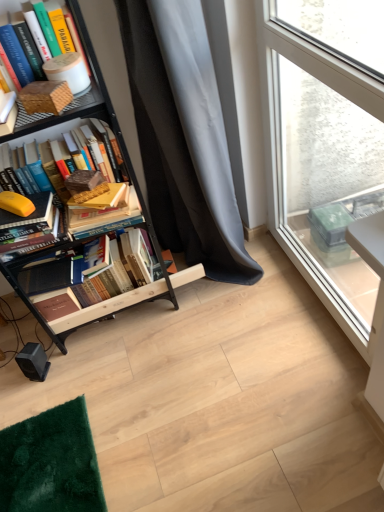
Question: Based on their positions, is orange matte banana at lower left, placed as the third book when sorted from top to bottom, located to the left or right of matte brown book at upper left, which ranks as the fifth book in bottom-to-top order?

Choices:
 (A) right
 (B) left

Answer: (B)

Question: Is orange matte banana at lower left, placed as the third book when sorted from top to bottom, taller or shorter than matte brown book at upper left, which ranks as the fifth book in bottom-to-top order?

Choices:
 (A) short
 (B) tall

Answer: (A)

Question: Estimate the real-world distances between objects in this image. Which object is closer to the gray fabric curtain at center?

Choices:
 (A) orange matte banana at lower left, acting as the 3th book starting from the bottom
 (B) matte orange book at left, which appears as the 2th book when ordered from the bottom
 (C) matte brown book at upper left, which ranks as the fifth book in bottom-to-top order
 (D) hardcover books at left, the first book ordered from the bottom
 (E) hardcover book at left, marked as the 4th book in a bottom-to-top arrangement

Answer: (E)

Question: Which is nearer to the orange matte banana at lower left, placed as the third book when sorted from top to bottom?

Choices:
 (A) transparent glass window at upper right
 (B) brown matte paper at left
 (C) hardcover books at left, the first book ordered from the bottom
 (D) matte orange book at left, which appears as the 2th book when ordered from the bottom
 (E) black metal bookcase at left

Answer: (D)